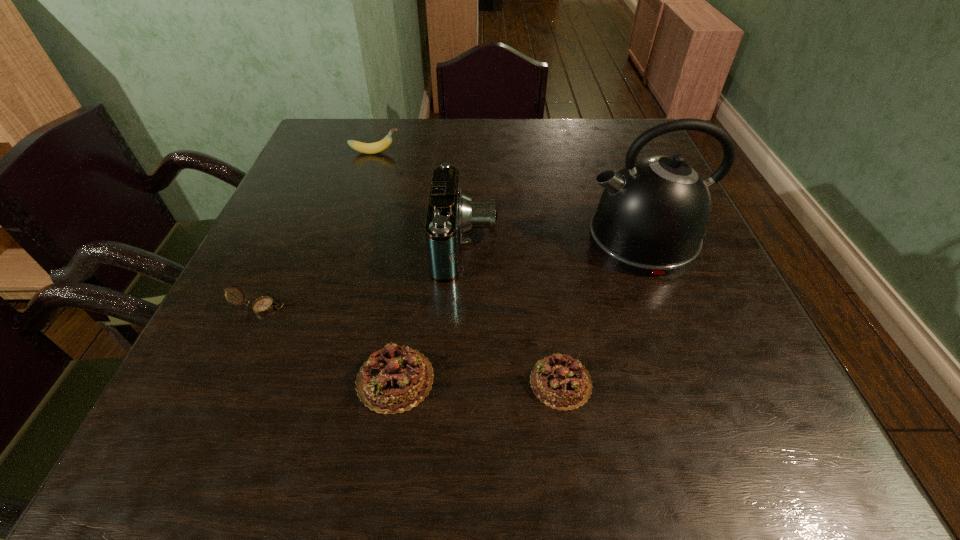
Find the location of a particular element. object that is the fourth closest to the left chocolate cake is located at coordinates (652, 215).

This screenshot has height=540, width=960. Identify the location of vacant area that satisfies the following two spatial constraints: 1. at the stem of the banana; 2. on the back side of the left chocolate cake. click(304, 379).

Where is `vacant space that satisfies the following two spatial constraints: 1. at the stem of the third tallest object; 2. on the right side of the fifth object from left to right`? This screenshot has height=540, width=960. vacant space that satisfies the following two spatial constraints: 1. at the stem of the third tallest object; 2. on the right side of the fifth object from left to right is located at coordinates (303, 382).